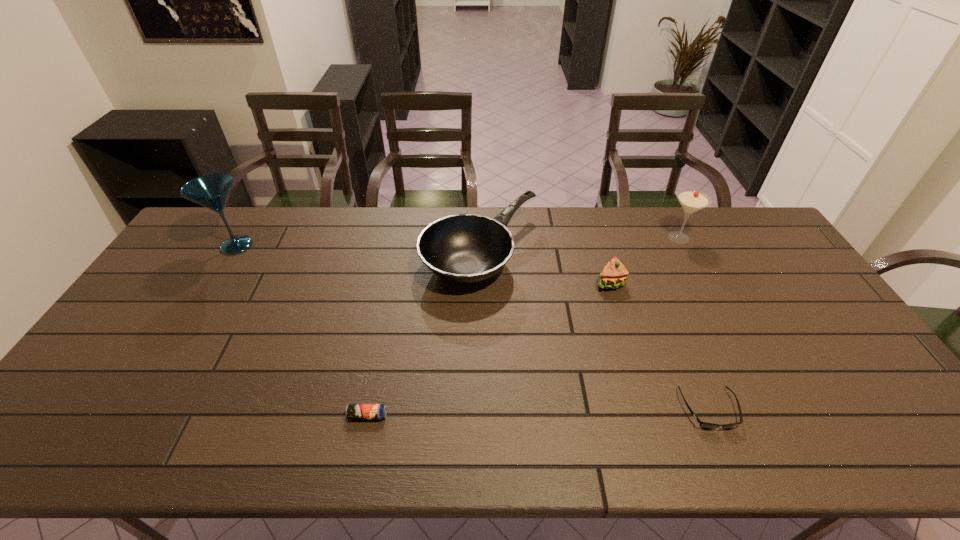
Image resolution: width=960 pixels, height=540 pixels. In order to click on vacant space at the far edge of the desktop in this screenshot , I will do `click(276, 241)`.

Where is `vacant region at the near edge of the desktop`? This screenshot has width=960, height=540. vacant region at the near edge of the desktop is located at coordinates (549, 432).

Locate an element on the screen. The width and height of the screenshot is (960, 540). vacant space at the right edge of the desktop is located at coordinates (843, 402).

In the image, there is a desktop. Where is `vacant space at the far left corner`? The width and height of the screenshot is (960, 540). vacant space at the far left corner is located at coordinates (241, 228).

The width and height of the screenshot is (960, 540). In order to click on unoccupied area between the fourth object from right to left and the fifth shortest object in this screenshot , I will do `click(580, 246)`.

Locate an element on the screen. empty space that is in between the left martini and the fifth object from right to left is located at coordinates (302, 330).

Find the location of a particular element. vacant point located between the sunglasses and the frying pan is located at coordinates (594, 332).

In order to click on free space between the second object from left to right and the third object from left to right in this screenshot , I will do `click(424, 335)`.

This screenshot has width=960, height=540. What are the coordinates of `vacant area between the sunglasses and the fifth object from right to left` in the screenshot? It's located at (539, 413).

The height and width of the screenshot is (540, 960). Find the location of `unoccupied area between the tallest object and the second object from right to left`. unoccupied area between the tallest object and the second object from right to left is located at coordinates (472, 327).